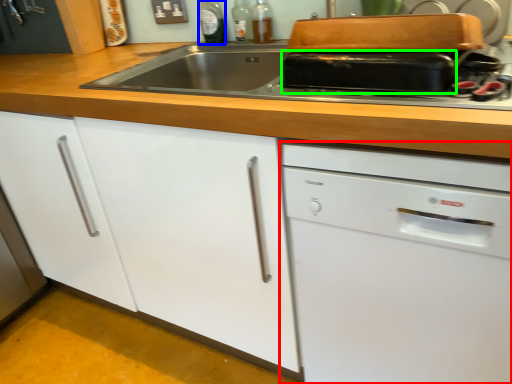
Question: Which is farther away from home appliance (highlighted by a red box)? bottle (highlighted by a blue box) or kitchen appliance (highlighted by a green box)?

Choices:
 (A) bottle
 (B) kitchen appliance

Answer: (A)